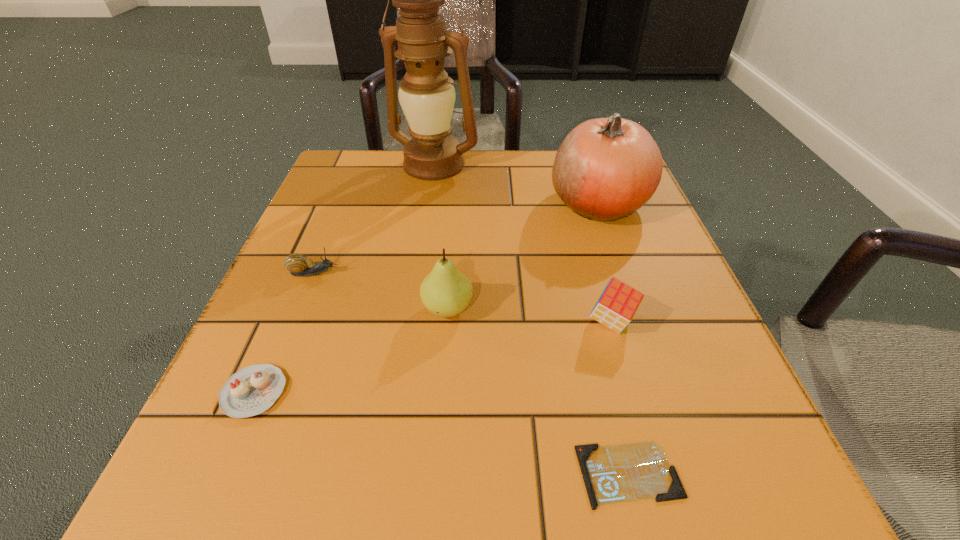
This screenshot has width=960, height=540. Identify the location of free space located on the right of the oil lamp. click(516, 165).

Identify the location of free location located 0.080m on the front of the pumpkin. Image resolution: width=960 pixels, height=540 pixels. (620, 262).

Locate an element on the screen. This screenshot has height=540, width=960. free region located 0.320m on the right of the pear is located at coordinates (672, 309).

You are a GUI agent. You are given a task and a screenshot of the screen. Output one action in this format:
    pyautogui.click(x=<x>, y=<y>)
    Task: Click on the free region located 0.390m on the back of the cube
    The width and height of the screenshot is (960, 540).
    Given the screenshot: What is the action you would take?
    pyautogui.click(x=570, y=179)

This screenshot has height=540, width=960. I want to click on free space located 0.270m on the front-facing side of the fifth tallest object, so click(x=493, y=273).

Identify the location of vacant space located 0.110m on the back of the second nearest object. (289, 310).

The image size is (960, 540). Identify the location of vacant space located 0.370m on the left of the nearest object. point(263,474).

Locate an element on the screen. This screenshot has width=960, height=540. oil lamp that is at the far edge is located at coordinates (426, 94).

The width and height of the screenshot is (960, 540). Find the location of `pumpkin present at the far edge`. pumpkin present at the far edge is located at coordinates (606, 168).

The image size is (960, 540). Find the location of `object present at the near edge`. object present at the near edge is located at coordinates (620, 473).